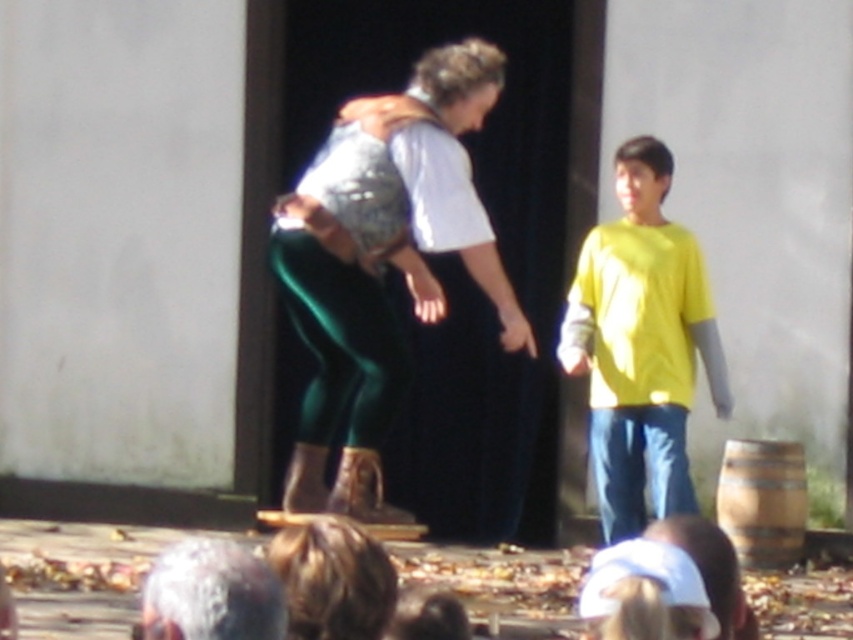
Question: Among these points, which one is farthest from the camera?

Choices:
 (A) (625, 330)
 (B) (357, 621)

Answer: (A)

Question: Which object appears farthest from the camera in this image?

Choices:
 (A) blonde hair at lower center
 (B) green velvet pants at center
 (C) gray wool sweater at center

Answer: (B)

Question: Is yellow matte shirt at center to the right of blonde hair at lower center from the viewer's perspective?

Choices:
 (A) yes
 (B) no

Answer: (A)

Question: Is green velvet pants at center further to the viewer compared to matte brown leather boots at lower center?

Choices:
 (A) yes
 (B) no

Answer: (A)

Question: Which point is farther to the camera?

Choices:
 (A) (316, 534)
 (B) (717, 540)
 (C) (657, 436)
 (D) (343, 512)

Answer: (C)

Question: Does green velvet pants at center appear on the right side of matte brown leather boots at lower center?

Choices:
 (A) yes
 (B) no

Answer: (B)